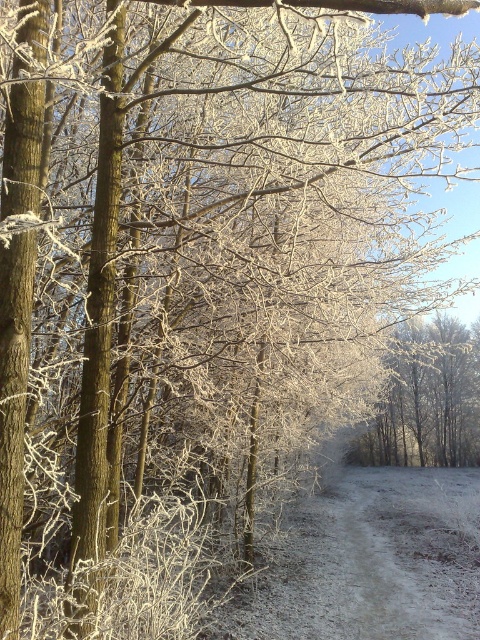
Can you confirm if frosted dirt path at center is positioned to the left of frosted branches at center?

Indeed, frosted dirt path at center is positioned on the left side of frosted branches at center.

Is frosted dirt path at center closer to the viewer compared to frosted branches at center?

Yes, frosted dirt path at center is closer to the viewer.

Measure the distance between frosted dirt path at center and camera.

The distance of frosted dirt path at center from camera is 9.53 meters.

At what (x,y) coordinates should I click in order to perform the action: click on frosted dirt path at center. Please return your answer as a coordinate pair (x, y). Image resolution: width=480 pixels, height=640 pixels. Looking at the image, I should click on (372, 563).